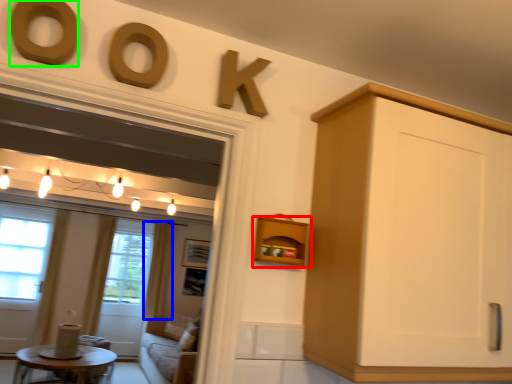
Question: Which object is the closest to the shelf (highlighted by a red box)? Choose among these: curtain (highlighted by a blue box) or oval (highlighted by a green box).

Choices:
 (A) curtain
 (B) oval

Answer: (B)